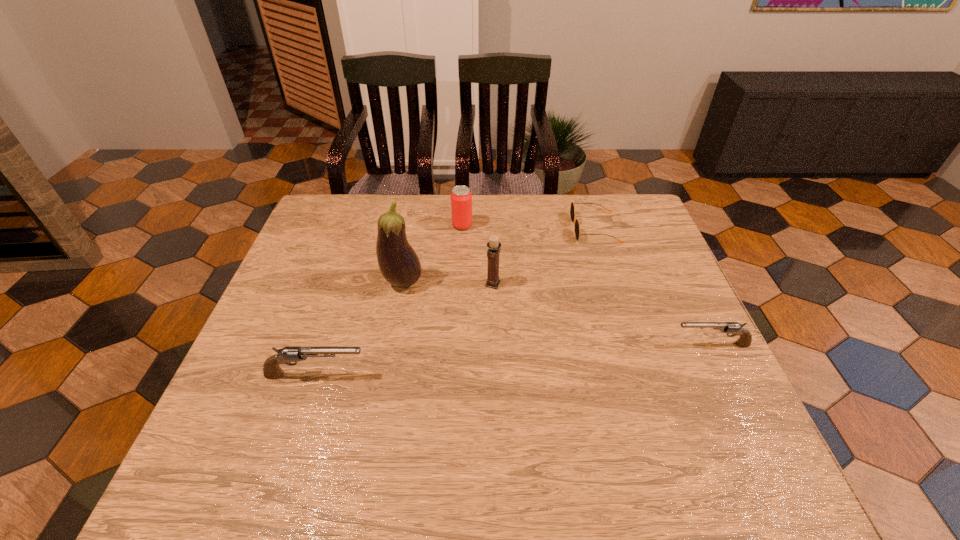
I want to click on vacant position for inserting another gun evenly, so click(x=519, y=359).